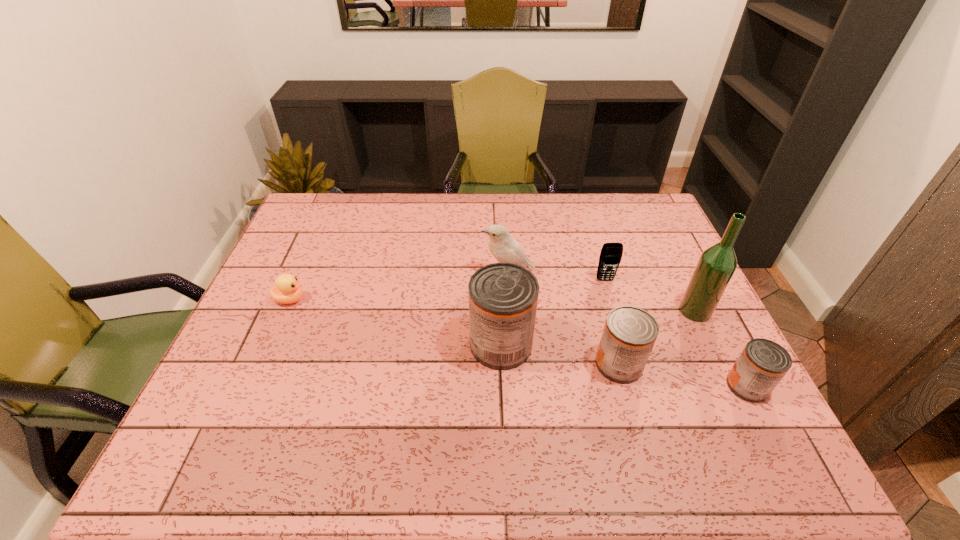
Identify the location of alcohol at the right edge. (717, 264).

I want to click on object that is at the near right corner, so click(762, 364).

Identify the location of free space at the far edge. The width and height of the screenshot is (960, 540). 415,228.

You are a GUI agent. You are given a task and a screenshot of the screen. Output one action in this format:
    pyautogui.click(x=<x>, y=<y>)
    Task: Click on the vacant space at the near edge of the desktop
    The image size is (960, 540).
    Given the screenshot: What is the action you would take?
    pyautogui.click(x=599, y=395)

The height and width of the screenshot is (540, 960). What are the coordinates of `vacant space at the left edge` in the screenshot? It's located at (291, 322).

You are a GUI agent. You are given a task and a screenshot of the screen. Output one action in this format:
    pyautogui.click(x=<x>, y=<y>)
    Task: Click on the free space at the right edge of the desktop
    
    Given the screenshot: What is the action you would take?
    pyautogui.click(x=726, y=360)

Find the location of `vacant space at the far right corner of the desktop`. vacant space at the far right corner of the desktop is located at coordinates (634, 232).

At what (x,y) coordinates should I click in order to perform the action: click on vacant area that lies between the shortest can and the second can from left to right. Please return your answer as a coordinate pair (x, y). The height and width of the screenshot is (540, 960). Looking at the image, I should click on (683, 375).

You are a GUI agent. You are given a task and a screenshot of the screen. Output one action in this format:
    pyautogui.click(x=<x>, y=<y>)
    Task: Click on the free area in between the shortest object and the second can from right to left
    The width and height of the screenshot is (960, 540).
    Given the screenshot: What is the action you would take?
    pyautogui.click(x=454, y=332)

You are a GUI agent. You are given a task and a screenshot of the screen. Output one action in this format:
    pyautogui.click(x=<x>, y=<y>)
    Task: Click on the vacant point located between the leftmost object and the second tallest can
    The width and height of the screenshot is (960, 540).
    Given the screenshot: What is the action you would take?
    pyautogui.click(x=454, y=332)